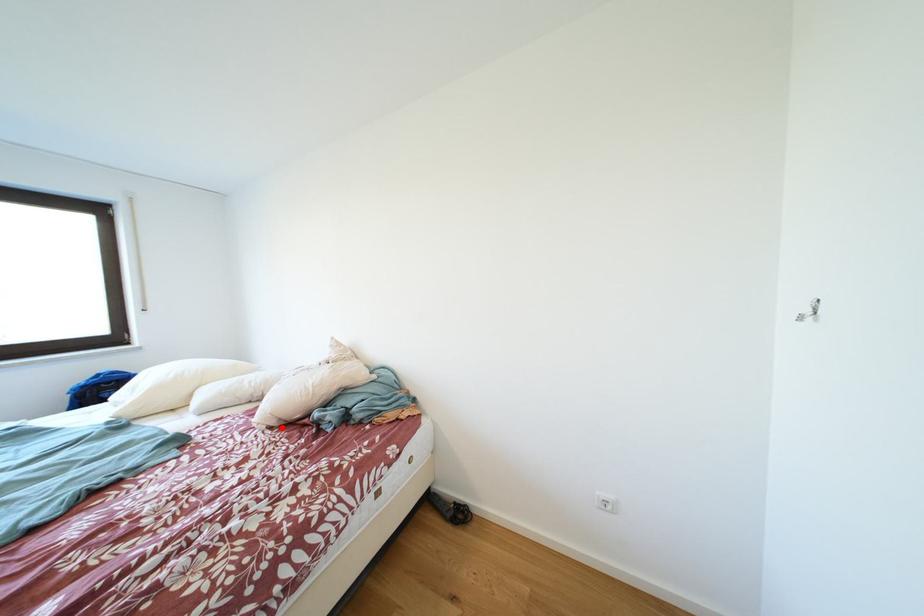
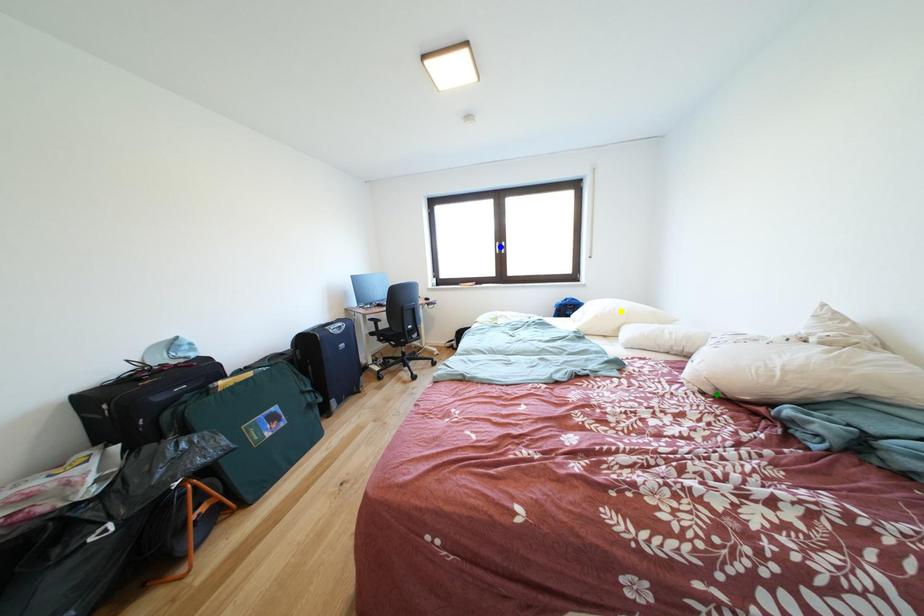
Question: I am providing you with two images of the same scene from different viewpoints. A red point is marked on the first image. You are given multiple points on the second image. Can you choose the point in image 2 that corresponds to the point in image 1?

Choices:
 (A) green point
 (B) yellow point
 (C) blue point

Answer: (A)